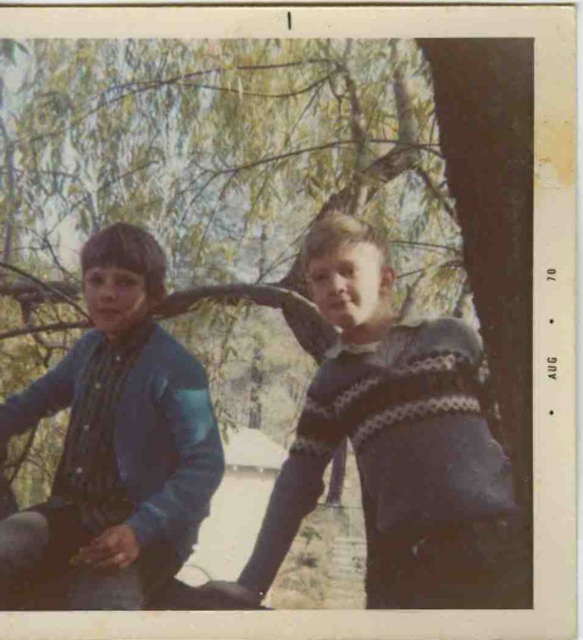
You are standing in a park and want to measure the distance to the green leafy tree at upper center. If your measuring tape can extend up to 4 meters, will it reach the tree?

The distance of green leafy tree at upper center from viewer is 3.96 meters, so yes, the measuring tape can reach it since it is within the 4 meters limit.

You are a photographer setting up a shot of the two children in the park. You need to ensure the green leafy tree at upper center and the blue denim jacket at left are both in frame. Based on their sizes, do you think the tree will appear larger than the jacket in the photo?

The green leafy tree at upper center might be wider than blue denim jacket at left, so it is likely the tree will appear larger in the photo.